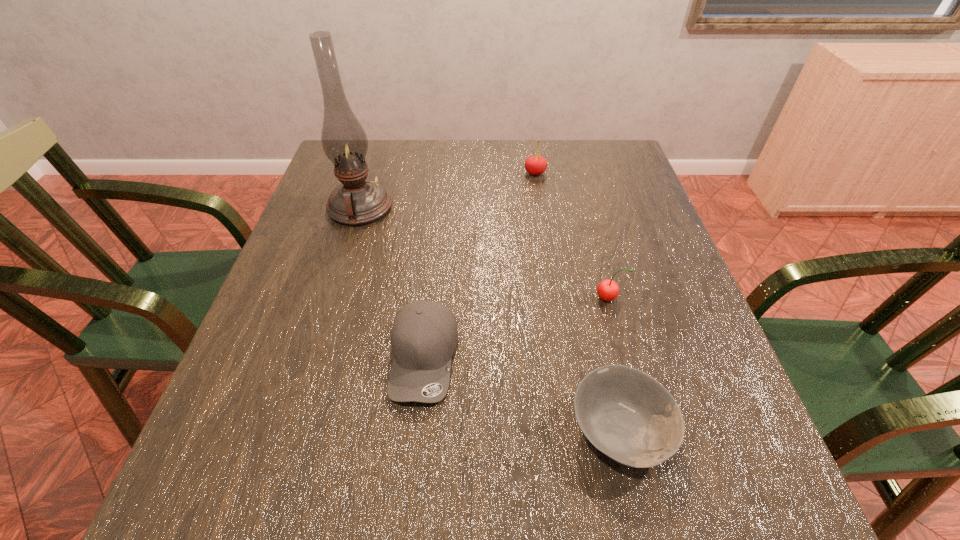
At what (x,y) coordinates should I click in order to perform the action: click on free spot between the baseball cap and the shortest object. Please return your answer as a coordinate pair (x, y). The width and height of the screenshot is (960, 540). Looking at the image, I should click on (522, 394).

Find the location of a particular element. The height and width of the screenshot is (540, 960). free space between the bowl and the farther cherry is located at coordinates (578, 301).

Where is `vacant space in between the shortest object and the fourth object from right to left`? vacant space in between the shortest object and the fourth object from right to left is located at coordinates (522, 394).

What are the coordinates of `free space between the third nearest object and the left cherry` in the screenshot? It's located at (572, 235).

Image resolution: width=960 pixels, height=540 pixels. Identify the location of vacant point located between the shortest object and the shorter cherry. (614, 363).

Locate an element on the screen. This screenshot has height=540, width=960. free space between the second farthest object and the baseball cap is located at coordinates (393, 283).

Where is `free space between the baseball cap and the third farthest object`? free space between the baseball cap and the third farthest object is located at coordinates (516, 328).

Point out which object is positioned as the second nearest to the oil lamp. Please provide its 2D coordinates. Your answer should be formatted as a tuple, i.e. [(x, y)], where the tuple contains the x and y coordinates of a point satisfying the conditions above.

[(535, 165)]

What are the coordinates of `the second closest object to the right cherry` in the screenshot? It's located at (424, 335).

At what (x,y) coordinates should I click in order to perform the action: click on vacant area in the image that satisfies the following two spatial constraints: 1. on the back side of the shorter cherry; 2. on the right side of the bowl. Please return your answer as a coordinate pair (x, y). Image resolution: width=960 pixels, height=540 pixels. Looking at the image, I should click on click(590, 298).